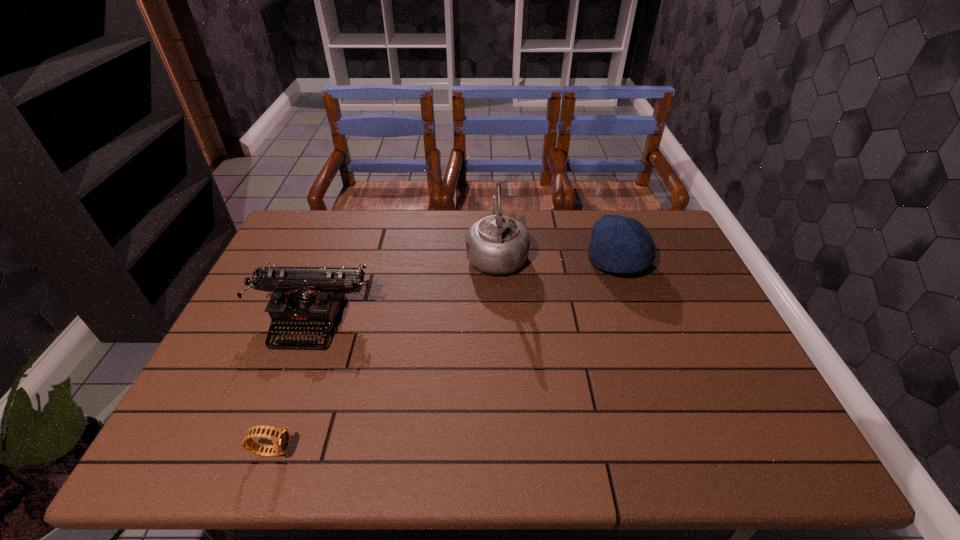
Where is `the tallest object`? Image resolution: width=960 pixels, height=540 pixels. the tallest object is located at coordinates (497, 245).

Where is `kettle`? kettle is located at coordinates (497, 245).

Locate an element on the screen. the rightmost object is located at coordinates (618, 244).

What are the coordinates of `the second nearest object` in the screenshot? It's located at (306, 299).

Locate an element on the screen. The height and width of the screenshot is (540, 960). the shortest object is located at coordinates (280, 437).

At what (x,y) coordinates should I click in order to perform the action: click on watch. Please return your answer as a coordinate pair (x, y). The image size is (960, 540). Looking at the image, I should click on (280, 437).

Locate an element on the screen. vacant area located at the spout of the kettle is located at coordinates (495, 222).

Identify the location of vacant space situated 0.200m on the back of the rightmost object. (599, 210).

This screenshot has width=960, height=540. Identify the location of vacant space located 0.100m on the keyboard of the third farthest object. (288, 384).

The image size is (960, 540). I want to click on vacant space positioned on the face of the shortest object, so click(376, 450).